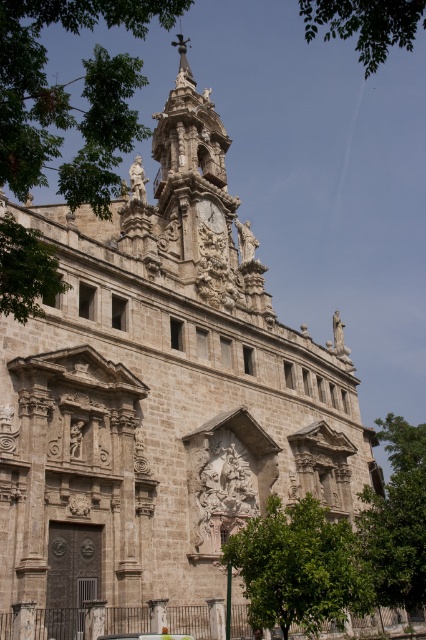
Question: Among these points, which one is farthest from the camera?

Choices:
 (A) (206, 211)
 (B) (19, 300)
 (C) (417, 472)

Answer: (A)

Question: Is green leafy tree at lower right bigger than metallic car at lower center?

Choices:
 (A) no
 (B) yes

Answer: (B)

Question: Can you confirm if green leafy tree at upper left is smaller than golden stone clock at center?

Choices:
 (A) yes
 (B) no

Answer: (B)

Question: Is green leafy tree at lower center positioned behind green leafy tree at upper right?

Choices:
 (A) yes
 (B) no

Answer: (A)

Question: Which point is closer to the camera?

Choices:
 (A) click(409, 44)
 (B) click(340, 536)
 (C) click(8, 134)

Answer: (C)

Question: Which of the following is the farthest from the observer?

Choices:
 (A) (411, 26)
 (B) (36, 172)

Answer: (A)